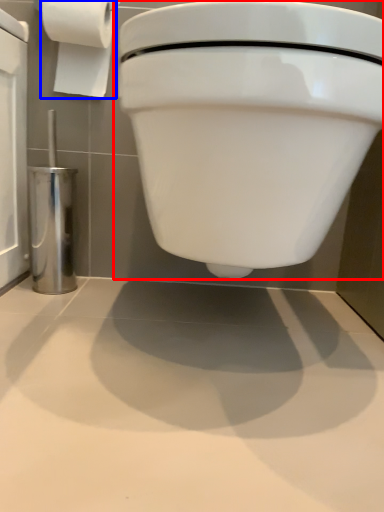
Question: Which object appears closest to the camera in this image, toilet (highlighted by a red box) or toilet paper (highlighted by a blue box)?

Choices:
 (A) toilet
 (B) toilet paper

Answer: (A)